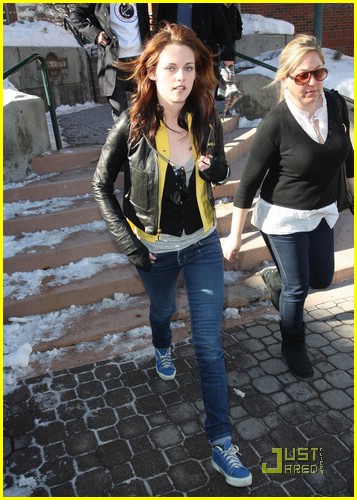
Where is `brick wall`? The height and width of the screenshot is (500, 357). brick wall is located at coordinates (337, 15).